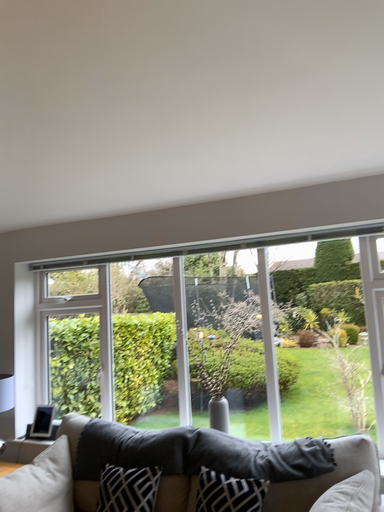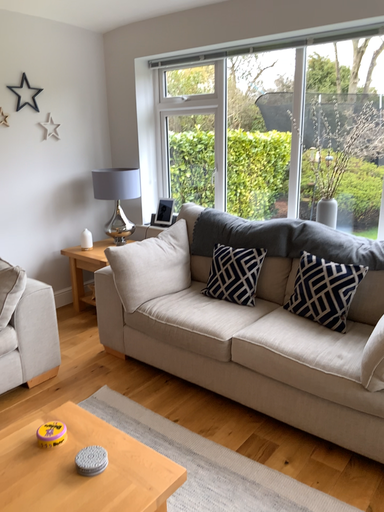
Question: Which way did the camera rotate in the video?

Choices:
 (A) rotated upward
 (B) rotated downward

Answer: (B)